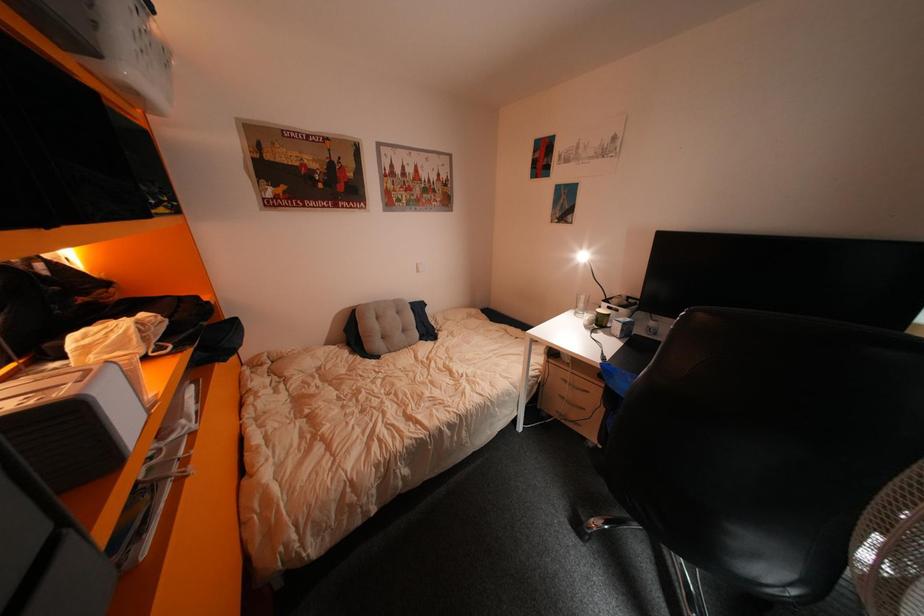
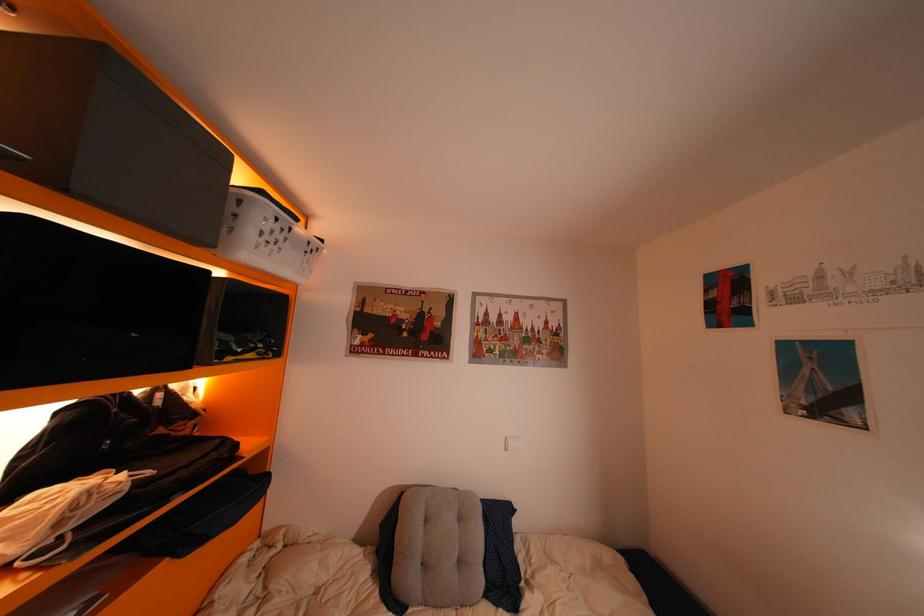
The first image is from the beginning of the video and the second image is from the end. How did the camera likely rotate when shooting the video?

The rotation direction of the camera is left-up.